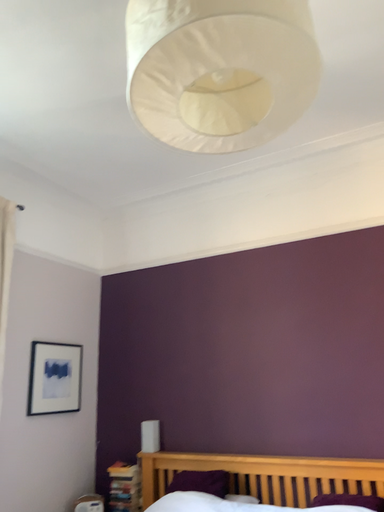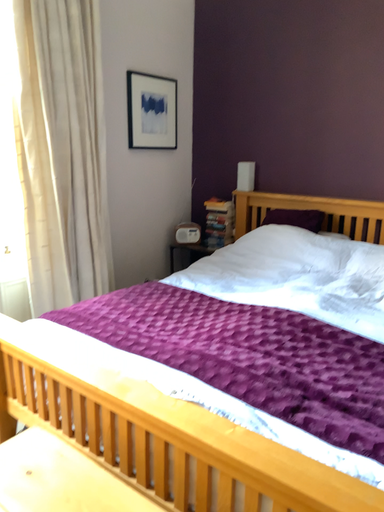
Question: Which way did the camera rotate in the video?

Choices:
 (A) rotated upward
 (B) rotated downward

Answer: (B)